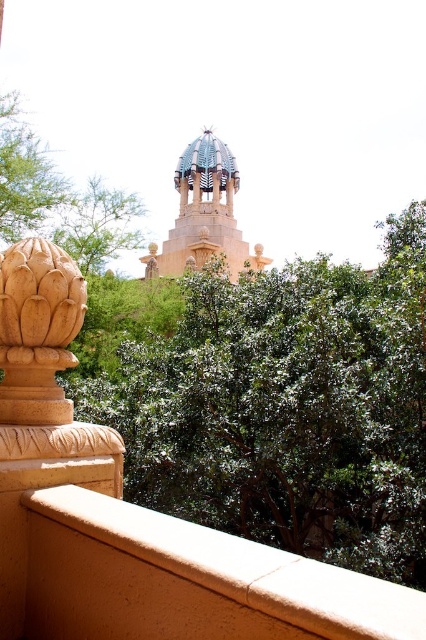
Question: Is green leafy tree at center wider than smooth beige ledge at lower left?

Choices:
 (A) no
 (B) yes

Answer: (B)

Question: From the image, what is the correct spatial relationship of smooth beige ledge at lower left in relation to green leafy tree at upper center?

Choices:
 (A) right
 (B) left

Answer: (A)

Question: Which object is the farthest from the golden stone finial at left?

Choices:
 (A) green leafy tree at upper center
 (B) green leafy tree at upper left

Answer: (B)

Question: Which point appears farthest from the camera in this image?

Choices:
 (A) (121, 237)
 (B) (2, 120)

Answer: (B)

Question: Which object is positioned closest to the green leafy tree at center?

Choices:
 (A) smooth beige ledge at lower left
 (B) green leafy tree at upper left

Answer: (A)

Question: Can you confirm if golden stone finial at left is positioned to the left of shiny gold dome at center?

Choices:
 (A) no
 (B) yes

Answer: (B)